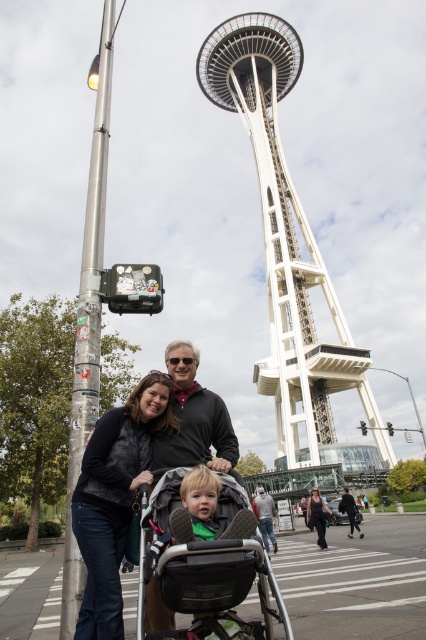
You are taking a photo of the white metallic space needle at center and the black matte pants at lower right. Which object is positioned more to the left in the image?

The white metallic space needle at center is positioned more to the left than the black matte pants at lower right.

You are a photographer planning to take a group photo of the family members in the scene. The black textured stroller at center and the black matte pants at lower right are part of the composition. Given their distance apart, can you estimate if they can be captured in a single frame without moving any of them?

The black textured stroller at center and the black matte pants at lower right are 37.27 meters apart. Since most cameras have a wide enough angle to capture such a distance in one frame, they can be included in a single photo without moving them.

You are a photographer at the Space Needle and want to place a small tripod between the man and the woman so it doesn not block the stroller. The stroller is at point (204, 561). Where should you place the tripod?

The black textured stroller at center is located at point (204, 561). To place the tripod between the man and the woman without blocking the stroller, position it near the midpoint between their positions, ensuring it stays clear of the stroller at (204, 561).